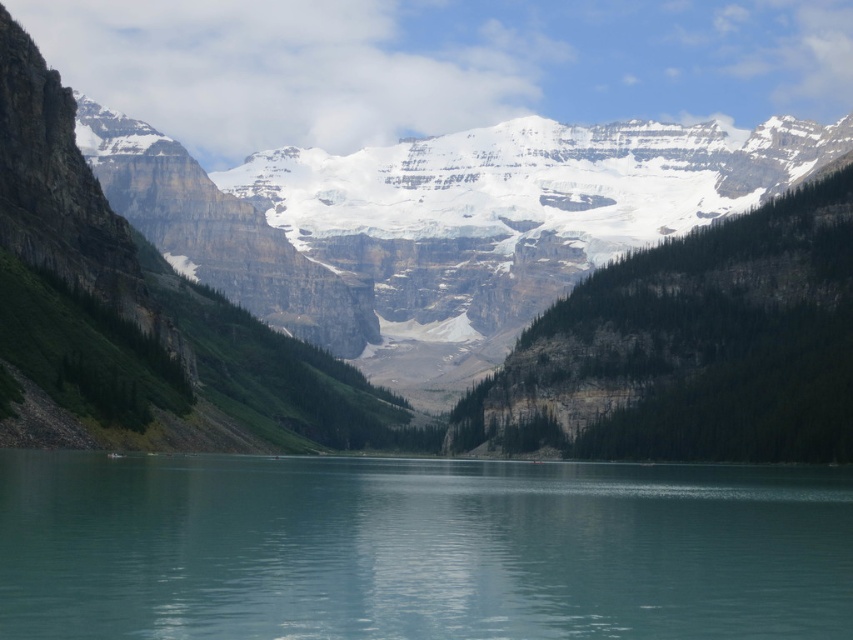
Question: Does rocky mountain range at center appear on the left side of turquoise glassy water at center?

Choices:
 (A) yes
 (B) no

Answer: (A)

Question: Which point appears closest to the camera in this image?

Choices:
 (A) (850, 296)
 (B) (706, 557)

Answer: (B)

Question: Which object appears farthest from the camera in this image?

Choices:
 (A) rocky mountain range at center
 (B) turquoise glassy water at center

Answer: (A)

Question: Does rocky mountain range at center have a greater width compared to turquoise glassy water at center?

Choices:
 (A) no
 (B) yes

Answer: (B)

Question: Among these objects, which one is nearest to the camera?

Choices:
 (A) turquoise glassy water at center
 (B) rocky mountain range at center

Answer: (A)

Question: Does rocky mountain range at center have a larger size compared to turquoise glassy water at center?

Choices:
 (A) yes
 (B) no

Answer: (A)